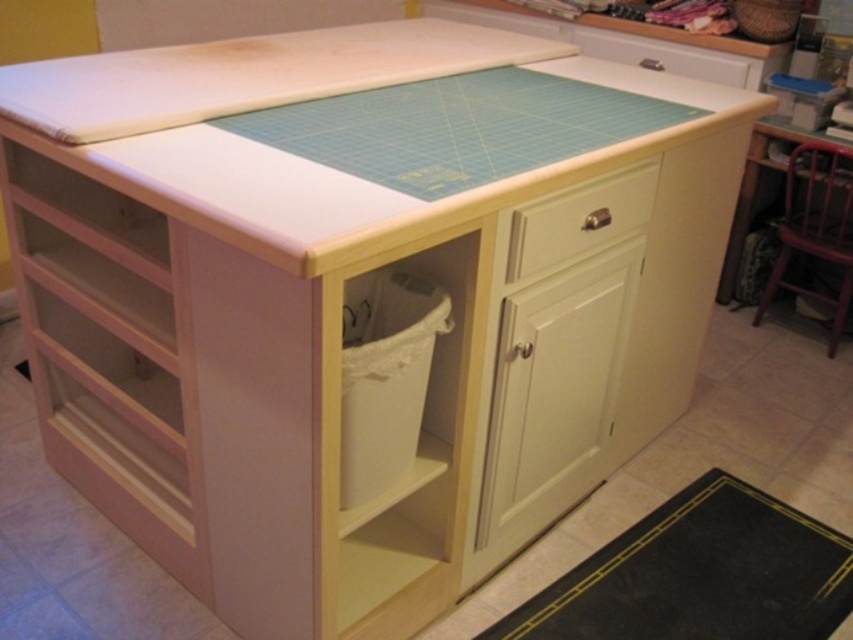
Question: Which point is closer to the camera?

Choices:
 (A) (550, 227)
 (B) (842, 282)

Answer: (A)

Question: Is wooden chair at right bigger than white wood drawer at right?

Choices:
 (A) no
 (B) yes

Answer: (B)

Question: Does wooden chair at right have a lesser width compared to white wood drawer at right?

Choices:
 (A) no
 (B) yes

Answer: (A)

Question: Does wooden chair at right have a larger size compared to white wood drawer at right?

Choices:
 (A) yes
 (B) no

Answer: (A)